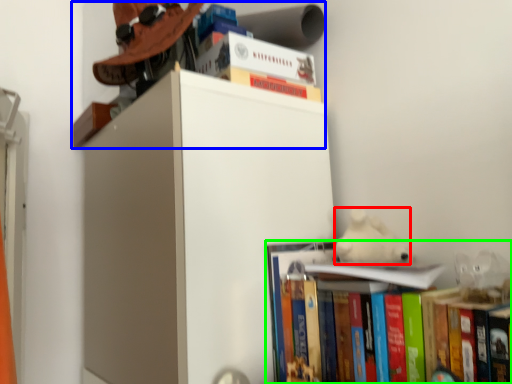
Question: Which object is the farthest from animal (highlighted by a red box)? Choose among these: shelf (highlighted by a blue box) or book (highlighted by a green box).

Choices:
 (A) shelf
 (B) book

Answer: (A)